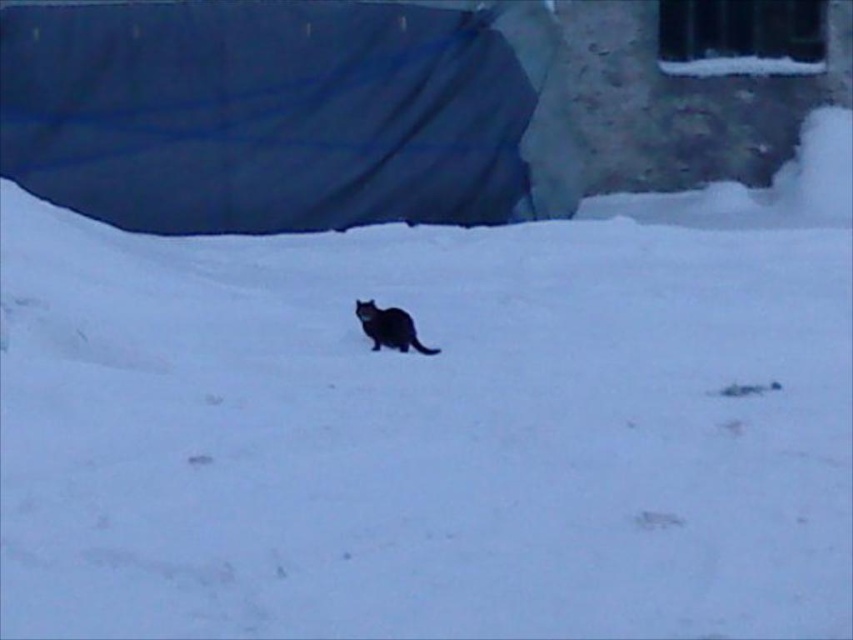
Question: Among these objects, which one is nearest to the camera?

Choices:
 (A) black fur cat at center
 (B) dark blue fabric at upper left

Answer: (A)

Question: Can you confirm if dark blue fabric at upper left is positioned above black fur cat at center?

Choices:
 (A) yes
 (B) no

Answer: (A)

Question: Which object is farther from the camera taking this photo?

Choices:
 (A) dark blue fabric at upper left
 (B) black fur cat at center

Answer: (A)

Question: Observing the image, what is the correct spatial positioning of dark blue fabric at upper left in reference to black fur cat at center?

Choices:
 (A) right
 (B) left

Answer: (B)

Question: Which point is farther to the camera?

Choices:
 (A) black fur cat at center
 (B) dark blue fabric at upper left

Answer: (B)

Question: Can you confirm if dark blue fabric at upper left is positioned to the left of black fur cat at center?

Choices:
 (A) no
 (B) yes

Answer: (B)